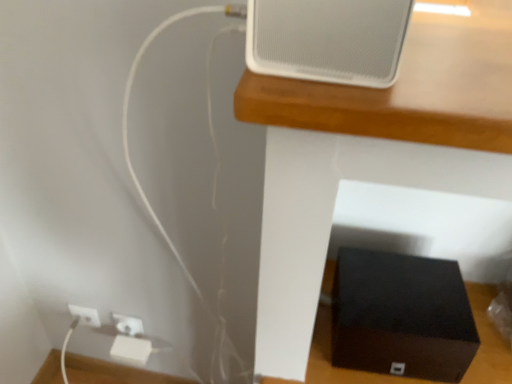
Question: Does black matte speaker at lower center have a larger size compared to white plastic electric outlet at lower left?

Choices:
 (A) no
 (B) yes

Answer: (B)

Question: Is black matte speaker at lower center aimed at white plastic electric outlet at lower left?

Choices:
 (A) yes
 (B) no

Answer: (B)

Question: From the image's perspective, is black matte speaker at lower center over white plastic electric outlet at lower left?

Choices:
 (A) no
 (B) yes

Answer: (B)

Question: Is black matte speaker at lower center to the left of white plastic electric outlet at lower left from the viewer's perspective?

Choices:
 (A) yes
 (B) no

Answer: (B)

Question: Is black matte speaker at lower center with white plastic electric outlet at lower left?

Choices:
 (A) yes
 (B) no

Answer: (B)

Question: Do you think black matte box at lower right is within black matte speaker at lower center, or outside of it?

Choices:
 (A) outside
 (B) inside

Answer: (B)

Question: Is black matte box at lower right taller or shorter than black matte speaker at lower center?

Choices:
 (A) short
 (B) tall

Answer: (A)

Question: Based on their sizes in the image, would you say black matte box at lower right is bigger or smaller than black matte speaker at lower center?

Choices:
 (A) small
 (B) big

Answer: (A)

Question: Is point (337, 261) closer or farther from the camera than point (304, 92)?

Choices:
 (A) closer
 (B) farther

Answer: (B)

Question: From a real-world perspective, is white matte speaker at upper center positioned above or below black matte speaker at lower center?

Choices:
 (A) below
 (B) above

Answer: (B)

Question: Is white matte speaker at upper center bigger or smaller than black matte speaker at lower center?

Choices:
 (A) small
 (B) big

Answer: (A)

Question: In the image, is white matte speaker at upper center positioned in front of or behind black matte speaker at lower center?

Choices:
 (A) behind
 (B) front

Answer: (B)

Question: In the image, is white matte speaker at upper center on the left side or the right side of black matte speaker at lower center?

Choices:
 (A) left
 (B) right

Answer: (A)

Question: From the image's perspective, is white plastic electric outlet at lower left located above or below white matte speaker at upper center?

Choices:
 (A) above
 (B) below

Answer: (B)

Question: Considering the relative positions of white plastic electric outlet at lower left and white matte speaker at upper center in the image provided, is white plastic electric outlet at lower left to the left or to the right of white matte speaker at upper center?

Choices:
 (A) left
 (B) right

Answer: (A)